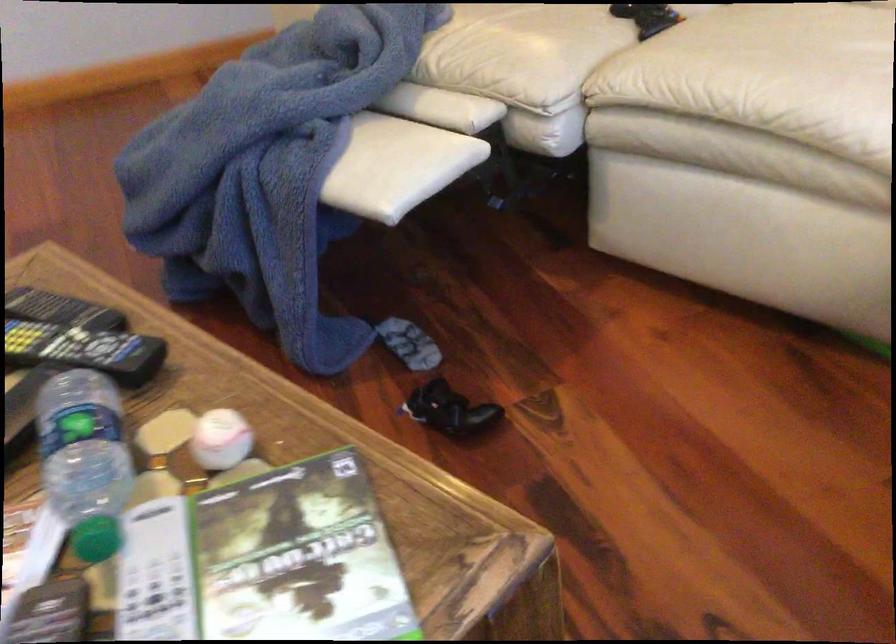
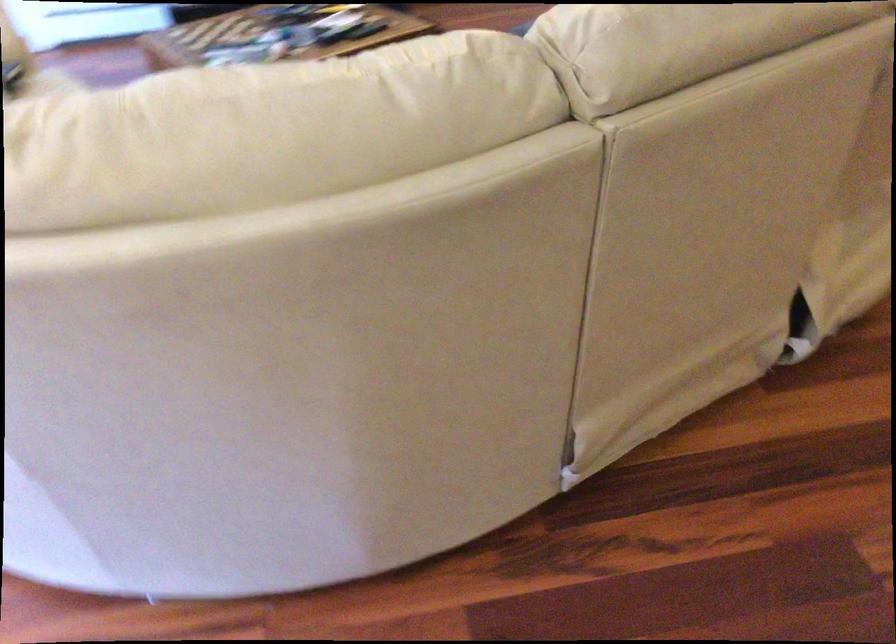
Question: I am providing you with two images of the same scene from different viewpoints. Which of the following objects are not visible in image2?

Choices:
 (A) sofa armrest
 (B) maroon suitcase
 (C) green video game case
 (D) sofa sitting surface

Answer: (C)